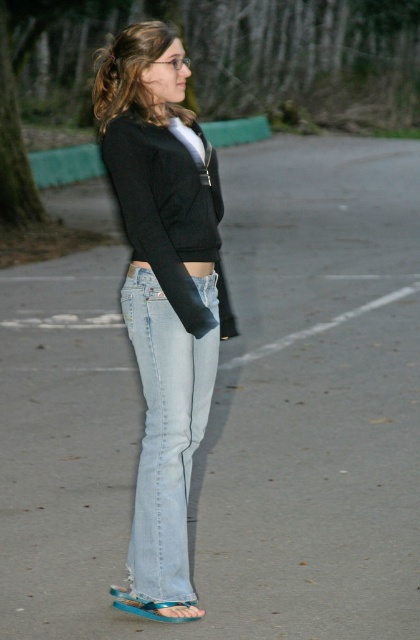
Question: Is light blue denim jeans at lower center smaller than blue rubber sandal at lower center?

Choices:
 (A) no
 (B) yes

Answer: (A)

Question: Estimate the real-world distances between objects in this image. Which object is farther from the light blue denim jeans at lower center?

Choices:
 (A) denim jeans at center
 (B) blue rubber sandal at lower center

Answer: (B)

Question: Which point is closer to the camera?

Choices:
 (A) (134, 172)
 (B) (133, 602)
 (C) (165, 70)
 (D) (202, 380)

Answer: (A)

Question: Can you confirm if light blue denim jeans at lower center is positioned to the right of black matte sweater at center?

Choices:
 (A) no
 (B) yes

Answer: (A)

Question: Which is farther from the light blue denim jeans at lower center?

Choices:
 (A) blue rubber sandal at lower center
 (B) black matte sweater at center
 (C) denim jeans at center

Answer: (A)

Question: Can you confirm if light blue denim jeans at lower center is positioned below blue rubber sandal at lower center?

Choices:
 (A) yes
 (B) no

Answer: (B)